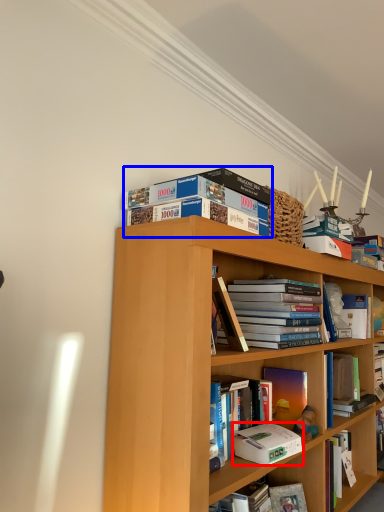
Question: Which point is further to the camera, paperback book (highlighted by a red box) or book (highlighted by a blue box)?

Choices:
 (A) paperback book
 (B) book

Answer: (A)